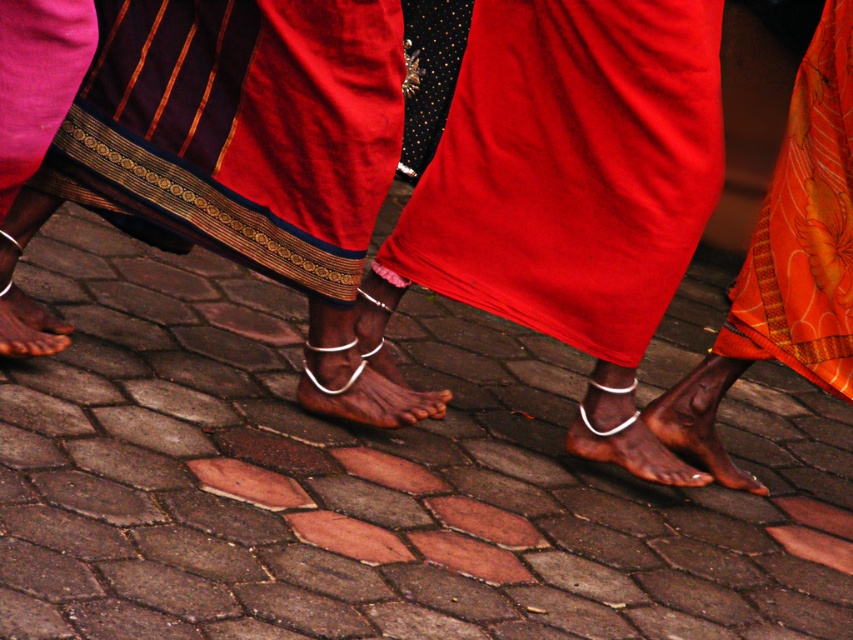
In the scene shown: You are an anthropologist studying traditional attire. You notice a point marked at coordinates (572, 168) in the image. Based on the scene, what material is most likely covering that point?

The point at (572, 168) is on matte red fabric at center, so the material covering that point is matte red fabric.

You are a photographer trying to capture the silver metallic anklet at center and the brown matte foot at lower left in a single frame. Based on their positions, which object should you adjust your camera to focus on first if you want to ensure both are in the frame?

The silver metallic anklet at center is to the right of brown matte foot at lower left, so you should focus on the brown matte foot at lower left first to ensure both are within the frame as you adjust.